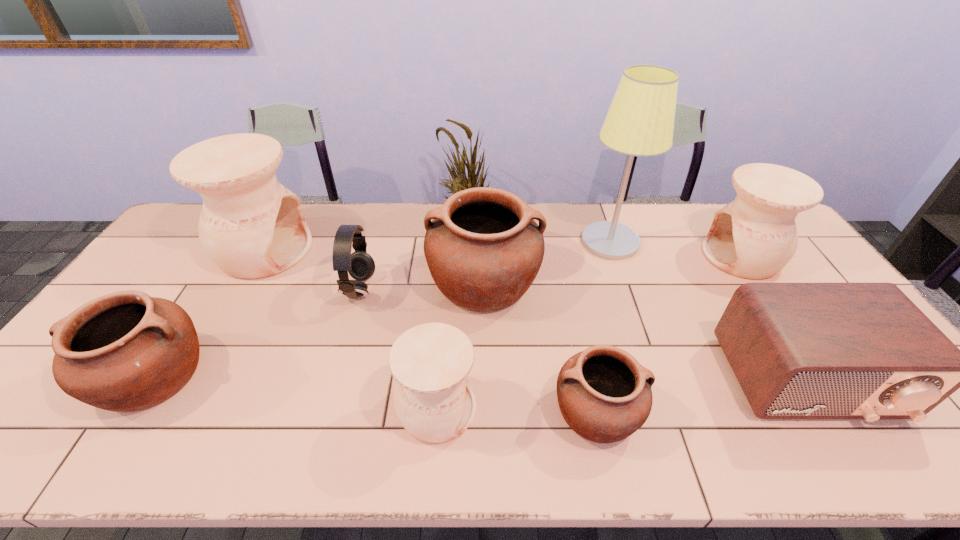
Find the location of a particular element. free location located on the ear cups of the seventh object from right to left is located at coordinates (400, 290).

What are the coordinates of `free space located 0.120m on the right of the leftmost reddish pottery` in the screenshot? It's located at (255, 376).

At what (x,y) coordinates should I click in order to perform the action: click on vacant point located 0.050m at the open side of the smallest cream pottery. Please return your answer as a coordinate pair (x, y). The height and width of the screenshot is (540, 960). Looking at the image, I should click on [497, 409].

Where is `vacant space located on the left of the shortest object`? This screenshot has height=540, width=960. vacant space located on the left of the shortest object is located at coordinates (403, 411).

At what (x,y) coordinates should I click in order to perform the action: click on table lamp present at the far edge. Please return your answer as a coordinate pair (x, y). Image resolution: width=960 pixels, height=540 pixels. Looking at the image, I should click on (640, 122).

Where is `radio receiver at the near edge`? The width and height of the screenshot is (960, 540). radio receiver at the near edge is located at coordinates (865, 351).

Locate an element on the screen. Image resolution: width=960 pixels, height=540 pixels. object situated at the left edge is located at coordinates (125, 351).

You are a GUI agent. You are given a task and a screenshot of the screen. Output one action in this format:
    pyautogui.click(x=<x>, y=<y>)
    Task: Click on the pottery that is at the right edge
    
    Given the screenshot: What is the action you would take?
    pyautogui.click(x=755, y=236)

Locate an element on the screen. radio receiver at the right edge is located at coordinates (865, 351).

The height and width of the screenshot is (540, 960). What are the coordinates of `object located at the near left corner` in the screenshot? It's located at (125, 351).